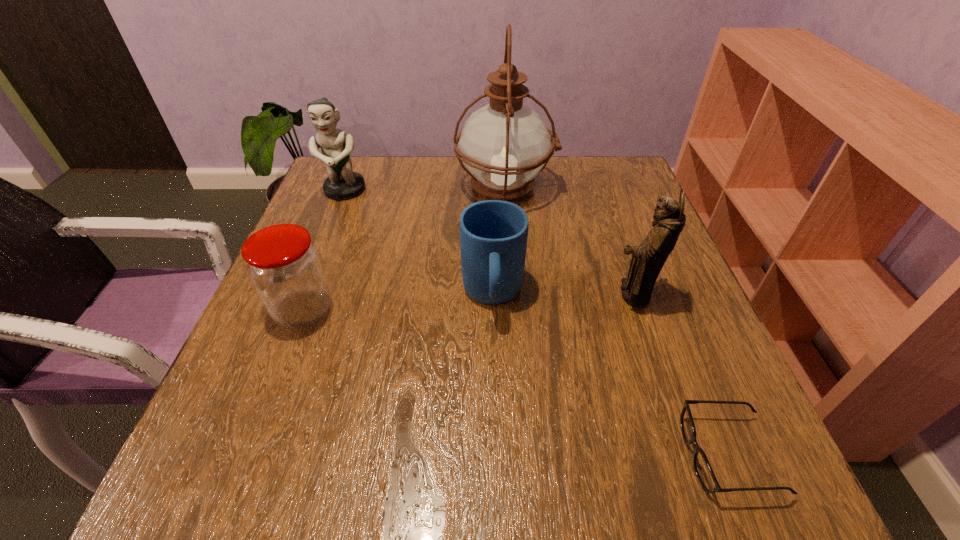
At what (x,y) coordinates should I click in order to perform the action: click on free space located on the front-facing side of the nearer figurine. Please return your answer as a coordinate pair (x, y). This screenshot has height=540, width=960. Looking at the image, I should click on (438, 294).

Where is `vacant space located on the front-facing side of the farther figurine`? This screenshot has height=540, width=960. vacant space located on the front-facing side of the farther figurine is located at coordinates (296, 313).

At what (x,y) coordinates should I click in order to perform the action: click on free spot located 0.130m on the back of the jar. Please return your answer as a coordinate pair (x, y). The width and height of the screenshot is (960, 540). Looking at the image, I should click on (327, 246).

This screenshot has height=540, width=960. In order to click on vacant space located 0.230m on the side of the mug with the handle in this screenshot , I will do `click(497, 456)`.

Locate an element on the screen. This screenshot has width=960, height=540. vacant space located 0.380m on the front-facing side of the nearest object is located at coordinates point(420,455).

This screenshot has height=540, width=960. I want to click on vacant space situated on the front-facing side of the nearest object, so click(468, 455).

Locate an element on the screen. The width and height of the screenshot is (960, 540). free space located on the front-facing side of the nearest object is located at coordinates (622, 455).

Where is `oil lamp that is positioned at the far edge`? This screenshot has height=540, width=960. oil lamp that is positioned at the far edge is located at coordinates (504, 145).

Where is `figurine at the far edge`? This screenshot has height=540, width=960. figurine at the far edge is located at coordinates (342, 184).

What are the coordinates of `object at the near edge` in the screenshot? It's located at (702, 468).